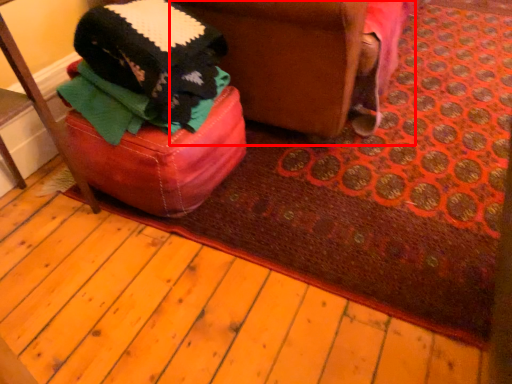
Question: From the image's perspective, considering the relative positions of swivel chair (annotated by the red box) and furniture in the image provided, where is swivel chair (annotated by the red box) located with respect to the staircase?

Choices:
 (A) below
 (B) above

Answer: (B)